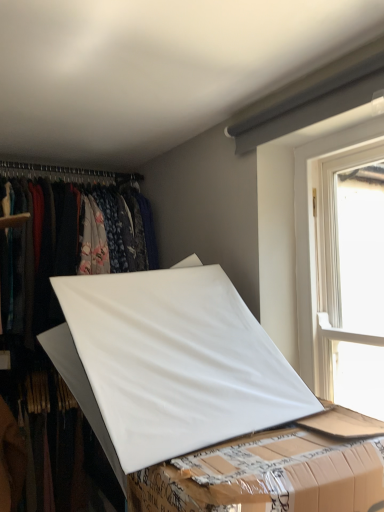
Question: Is white plastic window at upper right aimed at white matte board at center?

Choices:
 (A) no
 (B) yes

Answer: (B)

Question: From a real-world perspective, is white plastic window at upper right physically above white matte board at center?

Choices:
 (A) no
 (B) yes

Answer: (B)

Question: Can you confirm if white plastic window at upper right is positioned to the left of white matte board at center?

Choices:
 (A) yes
 (B) no

Answer: (B)

Question: Considering the relative sizes of white plastic window at upper right and white matte board at center in the image provided, is white plastic window at upper right smaller than white matte board at center?

Choices:
 (A) yes
 (B) no

Answer: (A)

Question: Does white plastic window at upper right lie in front of white matte board at center?

Choices:
 (A) no
 (B) yes

Answer: (A)

Question: Is white plastic window at upper right to the left or to the right of white matte board at center in the image?

Choices:
 (A) right
 (B) left

Answer: (A)

Question: From a real-world perspective, is white plastic window at upper right physically located above or below white matte board at center?

Choices:
 (A) above
 (B) below

Answer: (A)

Question: Based on their sizes in the image, would you say white plastic window at upper right is bigger or smaller than white matte board at center?

Choices:
 (A) small
 (B) big

Answer: (A)

Question: In terms of height, does white plastic window at upper right look taller or shorter compared to white matte board at center?

Choices:
 (A) short
 (B) tall

Answer: (B)

Question: Considering the positions of white matte board at center and white matte board at center in the image, is white matte board at center taller or shorter than white matte board at center?

Choices:
 (A) short
 (B) tall

Answer: (B)

Question: Considering the positions of white matte board at center and white matte board at center in the image, is white matte board at center bigger or smaller than white matte board at center?

Choices:
 (A) big
 (B) small

Answer: (A)

Question: In the image, is white matte board at center positioned in front of or behind white matte board at center?

Choices:
 (A) behind
 (B) front

Answer: (A)

Question: Considering the positions of point (288, 381) and point (201, 496), is point (288, 381) closer or farther from the camera than point (201, 496)?

Choices:
 (A) farther
 (B) closer

Answer: (A)

Question: Considering their positions, is white plastic window at upper right located in front of or behind white matte board at center?

Choices:
 (A) front
 (B) behind

Answer: (B)

Question: From a real-world perspective, is white plastic window at upper right above or below white matte board at center?

Choices:
 (A) below
 (B) above

Answer: (B)